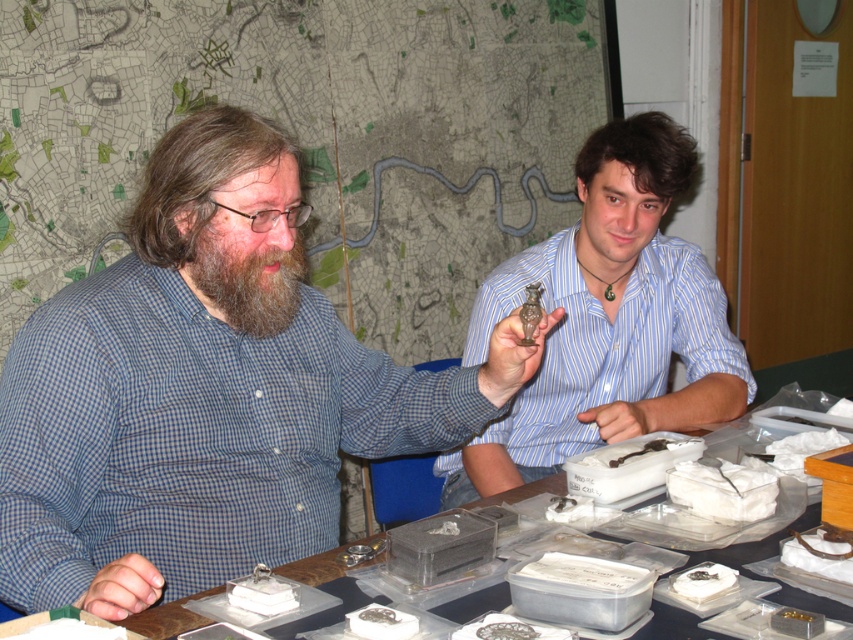
You are a food critic who needs to describe the presentation of the dishes in the image. Which object is taller between the green matte food at lower left and the matte silver plate at center?

The green matte food at lower left has a greater height compared to the matte silver plate at center, so the green matte food at lower left is taller.

You are a waiter in a restaurant and you see the green matte food at lower left and the matte silver plate at center. Which one is positioned more to the left side of the table?

The green matte food at lower left is positioned more to the left side of the table than the matte silver plate at center.

You are a researcher examining the items on the table. You need to locate the green matte food at lower left. According to the coordinates provided, where exactly is it positioned?

The green matte food at lower left is located at point [61,628].